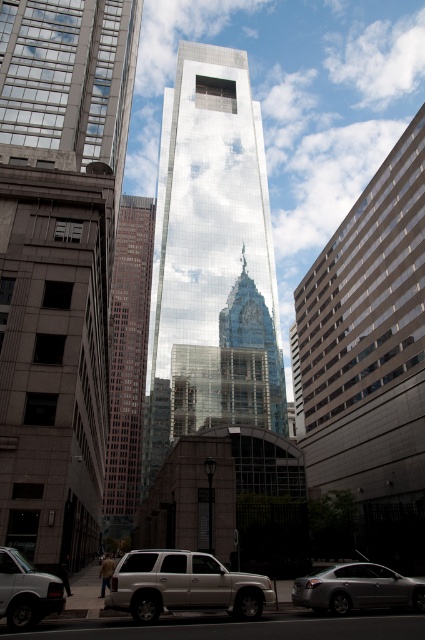
Question: Can you confirm if reflective glass skyscraper at center is thinner than silver metallic sedan at lower right?

Choices:
 (A) no
 (B) yes

Answer: (A)

Question: Does glassy reflective skyscraper at center appear on the left side of matte silver van at lower left?

Choices:
 (A) yes
 (B) no

Answer: (A)

Question: Is brown brick building at center thinner than matte silver van at lower left?

Choices:
 (A) no
 (B) yes

Answer: (A)

Question: Which point appears closest to the camera in this image?

Choices:
 (A) (17, 602)
 (B) (326, 608)
 (C) (73, 552)

Answer: (A)

Question: Which point appears farthest from the camera in this image?

Choices:
 (A) (159, 580)
 (B) (413, 596)
 (C) (14, 595)
 (D) (161, 240)

Answer: (D)

Question: Among these objects, which one is nearest to the camera?

Choices:
 (A) matte silver van at lower left
 (B) glassy reflective skyscraper at center
 (C) reflective glass skyscraper at center
 (D) silver metallic suv at lower center

Answer: (A)